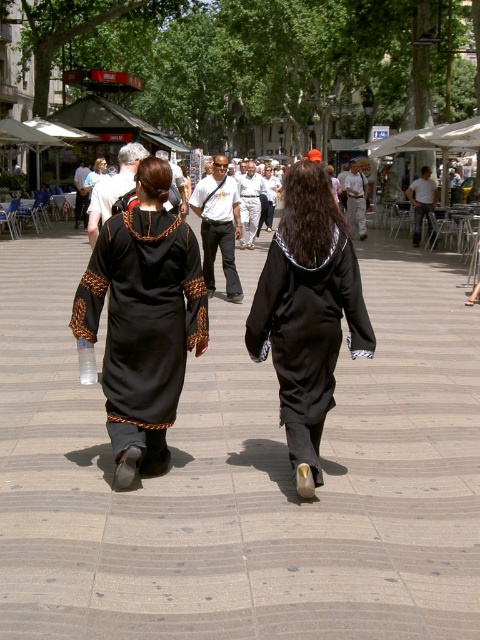
Question: Which of the following is the farthest from the observer?

Choices:
 (A) (167, 314)
 (B) (218, 220)
 (C) (447, 547)
 (D) (354, 200)

Answer: (D)

Question: Which object is farther from the camera taking this photo?

Choices:
 (A) smooth concrete pavement at center
 (B) white cotton shirt at center
 (C) black woven dress at center
 (D) black matte dress at center

Answer: (B)

Question: Is smooth concrete pavement at center to the right of black woven dress at center from the viewer's perspective?

Choices:
 (A) no
 (B) yes

Answer: (B)

Question: Is smooth concrete pavement at center to the right of black matte dress at center from the viewer's perspective?

Choices:
 (A) no
 (B) yes

Answer: (A)

Question: Is smooth concrete pavement at center thinner than white cotton shirt at center?

Choices:
 (A) no
 (B) yes

Answer: (A)

Question: Which point is closer to the camera taking this photo?

Choices:
 (A) (72, 323)
 (B) (229, 234)
 (C) (4, 474)
 (D) (355, 346)

Answer: (D)